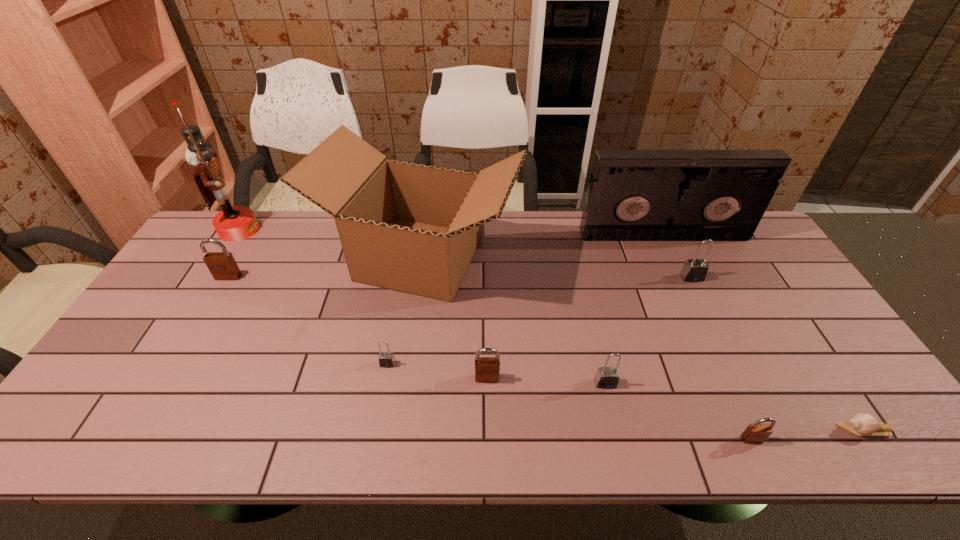
Identify the location of empty space that is in between the box and the smallest gray padlock. The image size is (960, 540). (404, 310).

You are a GUI agent. You are given a task and a screenshot of the screen. Output one action in this format:
    pyautogui.click(x=<x>, y=<y>)
    Task: Click on the free spot between the nutcracker and the nearest brown padlock
    This screenshot has width=960, height=540.
    Given the screenshot: What is the action you would take?
    pyautogui.click(x=495, y=335)

Locate an element on the screen. The height and width of the screenshot is (540, 960). vacant point located between the second gray padlock from right to left and the nearest brown padlock is located at coordinates (679, 411).

Identify the location of the fourth closest object to the biggest brown padlock. This screenshot has height=540, width=960. (487, 369).

Identify the location of object that is the eighth closest to the videotape. The height and width of the screenshot is (540, 960). (222, 265).

Identify which padlock is the third nearest to the nearest brown padlock. Please provide its 2D coordinates. Your answer should be formatted as a tuple, i.e. [(x, y)], where the tuple contains the x and y coordinates of a point satisfying the conditions above.

[(487, 369)]

Identify the location of padlock that is the fourth closest to the second smallest brown padlock. (694, 270).

The image size is (960, 540). I want to click on gray padlock that is the second closest to the smallest brown padlock, so click(694, 270).

Locate which gray padlock ranks third in proximity to the second smallest brown padlock. Please provide its 2D coordinates. Your answer should be formatted as a tuple, i.e. [(x, y)], where the tuple contains the x and y coordinates of a point satisfying the conditions above.

[(694, 270)]

I want to click on brown padlock that is the second closest to the smallest brown padlock, so click(222, 265).